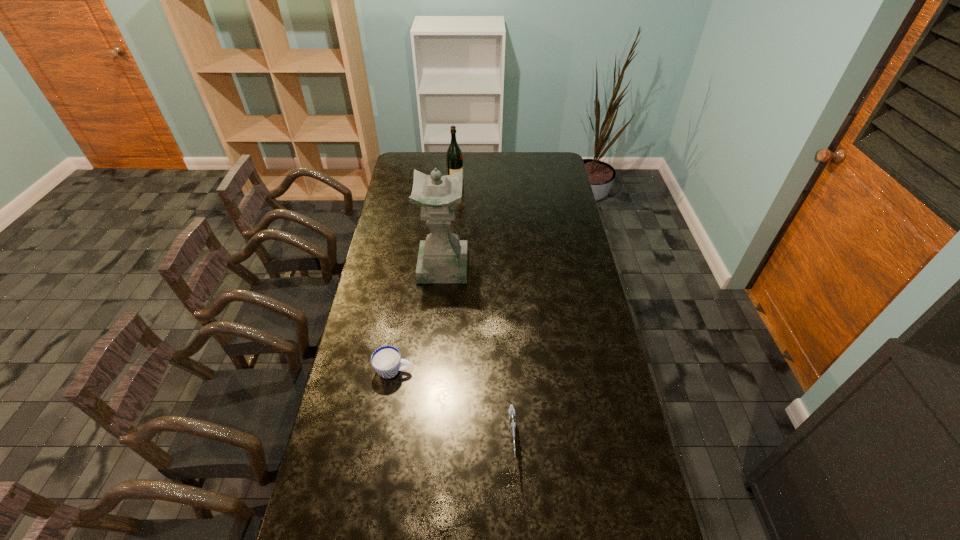
Locate an element on the screen. vacant space situated on the side of the cup with the handle is located at coordinates (512, 371).

This screenshot has height=540, width=960. I want to click on object located in the left edge section of the desktop, so click(386, 360).

In the image, there is a desktop. In order to click on vacant space at the far edge in this screenshot , I will do `click(483, 161)`.

At what (x,y) coordinates should I click in order to perform the action: click on vacant space at the left edge. Please return your answer as a coordinate pair (x, y). Looking at the image, I should click on (330, 535).

Where is `blank space at the right edge of the desktop`? Image resolution: width=960 pixels, height=540 pixels. blank space at the right edge of the desktop is located at coordinates (590, 297).

At what (x,y) coordinates should I click in order to perform the action: click on free space at the far right corner of the desktop. Please return your answer as a coordinate pair (x, y). Looking at the image, I should click on (559, 165).

What are the coordinates of `free space between the sculpture and the rightmost object` in the screenshot? It's located at (478, 353).

The height and width of the screenshot is (540, 960). Identify the location of free area in between the third nearest object and the second nearest object. (419, 319).

Identify the location of vacant space in between the nearest object and the liquor. Image resolution: width=960 pixels, height=540 pixels. (484, 312).

The width and height of the screenshot is (960, 540). Identify the location of free point between the sculpture and the second nearest object. (419, 319).